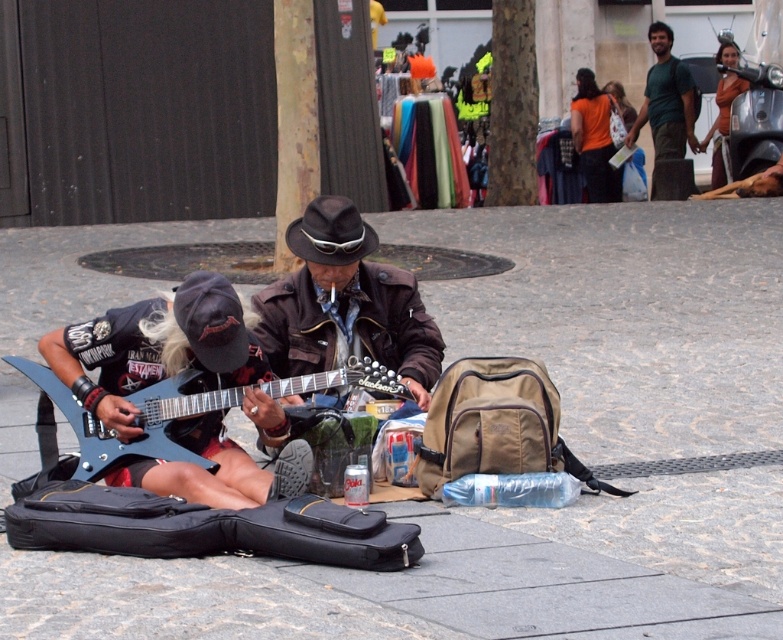
Which of these two, brown leather jacket at center or leather jacket at upper right, stands taller?

leather jacket at upper right

Looking at this image, does brown leather jacket at center come behind leather jacket at upper right?

No, it is not.

Which is in front, point (392, 275) or point (729, 61)?

Point (392, 275) is more forward.

Find the location of `brown leather jacket at center`. brown leather jacket at center is located at coordinates (345, 304).

Is the position of green fabric shirt at upper right more distant than that of orange t-shirt at upper right?

Yes.

Who is taller, green fabric shirt at upper right or orange t-shirt at upper right?

With more height is green fabric shirt at upper right.

Is point (648, 108) in front of point (590, 170)?

No, it is behind (590, 170).

I want to click on green fabric shirt at upper right, so click(x=666, y=116).

Does brown leather jacket at center have a lesser width compared to metallic blue guitar at center?

Yes, brown leather jacket at center is thinner than metallic blue guitar at center.

Between brown leather jacket at center and metallic blue guitar at center, which one appears on the right side from the viewer's perspective?

From the viewer's perspective, brown leather jacket at center appears more on the right side.

Where is `brown leather jacket at center`? This screenshot has height=640, width=783. brown leather jacket at center is located at coordinates click(x=345, y=304).